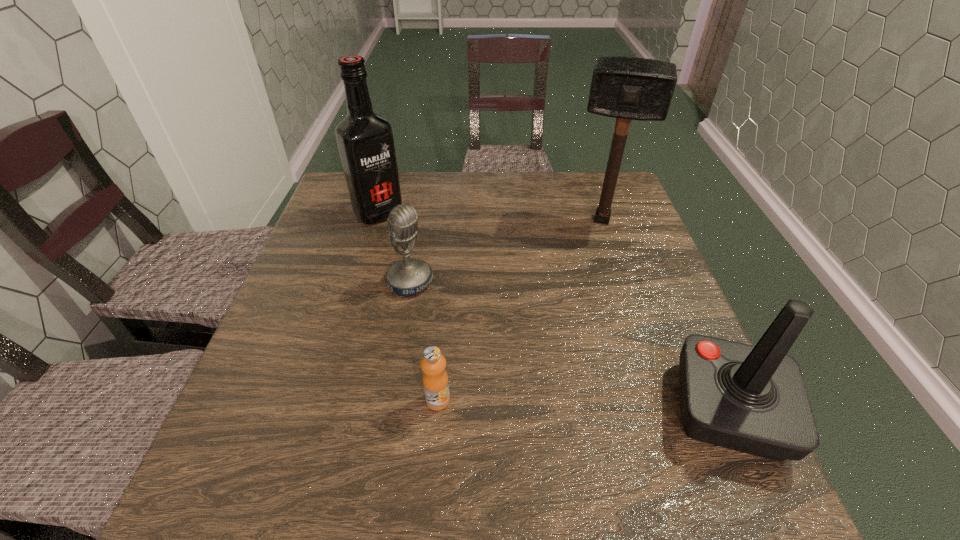
This screenshot has width=960, height=540. I want to click on orange juice that is at the near edge, so click(x=435, y=379).

Where is `joystick situated at the near edge`? This screenshot has height=540, width=960. joystick situated at the near edge is located at coordinates (752, 399).

Locate an element on the screen. object at the left edge is located at coordinates (365, 140).

Where is `joystick present at the right edge`? joystick present at the right edge is located at coordinates (752, 399).

Image resolution: width=960 pixels, height=540 pixels. Identify the location of mallet that is at the right edge. (626, 88).

I want to click on object at the far left corner, so click(x=365, y=140).

Where is `object present at the far right corner`? The height and width of the screenshot is (540, 960). object present at the far right corner is located at coordinates (626, 88).

The image size is (960, 540). What are the coordinates of `object that is positioned at the near right corner` in the screenshot? It's located at (752, 399).

The width and height of the screenshot is (960, 540). In order to click on vacant space at the far edge in this screenshot , I will do `click(521, 202)`.

You are a GUI agent. You are given a task and a screenshot of the screen. Output one action in this format:
    pyautogui.click(x=<x>, y=<y>)
    Task: Click on the free spot at the near edge of the desktop
    
    Given the screenshot: What is the action you would take?
    (585, 413)